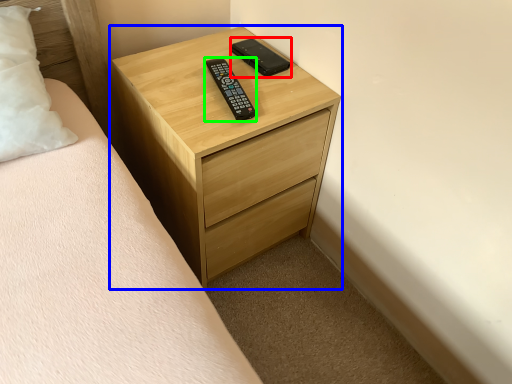
Question: Which object is the closest to the control (highlighted by a red box)? Choose among these: chest of drawers (highlighted by a blue box) or control (highlighted by a green box).

Choices:
 (A) chest of drawers
 (B) control

Answer: (B)